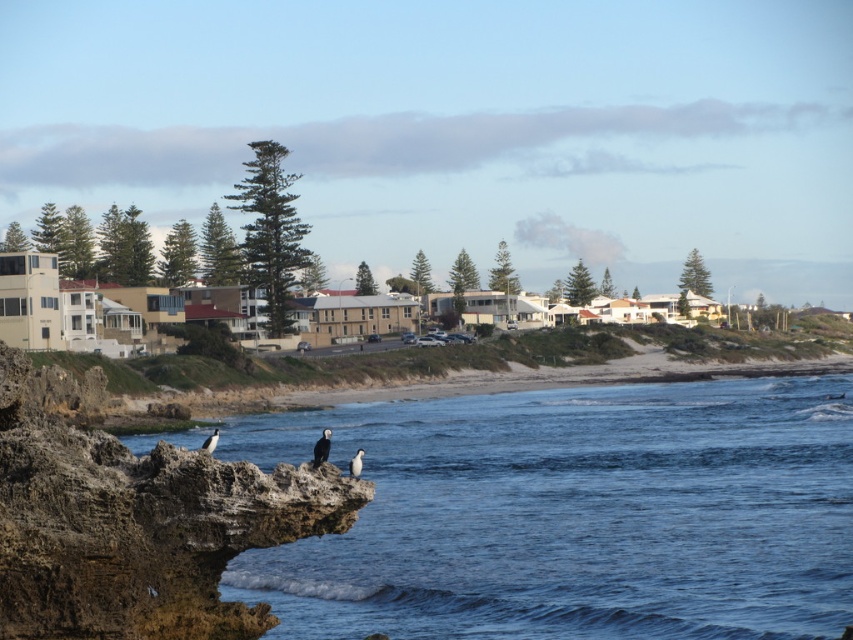
Where is `blue water at lower left`? This screenshot has width=853, height=640. blue water at lower left is located at coordinates (572, 515).

Which is above, blue water at lower left or white feathered bird at lower left?

Positioned higher is blue water at lower left.

The height and width of the screenshot is (640, 853). Identify the location of blue water at lower left. (572, 515).

Between brown rocky cliff at lower left and white glossy bird at lower center, which one is positioned lower?

Positioned lower is white glossy bird at lower center.

Does brown rocky cliff at lower left have a greater height compared to white glossy bird at lower center?

Indeed, brown rocky cliff at lower left has a greater height compared to white glossy bird at lower center.

Does point (190, 556) come in front of point (357, 456)?

That is True.

The height and width of the screenshot is (640, 853). Identify the location of brown rocky cliff at lower left. (134, 522).

Can you confirm if black feathered bird at lower left is taller than white glossy bird at lower center?

Yes.

Which of these two, black feathered bird at lower left or white glossy bird at lower center, stands shorter?

With less height is white glossy bird at lower center.

Which is in front, point (320, 449) or point (360, 454)?

Point (320, 449) is in front.

The height and width of the screenshot is (640, 853). In order to click on black feathered bird at lower left in this screenshot , I will do point(321,449).